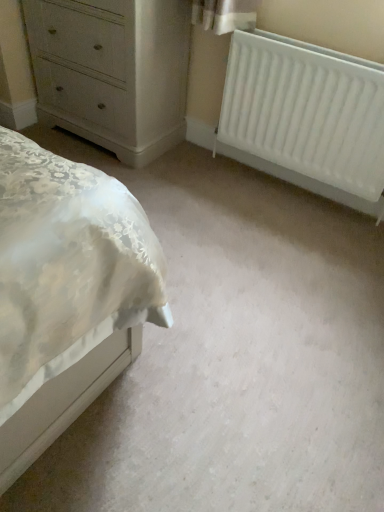
Question: Is white matte radiator at right at the back of white painted wood chest of drawers at upper left?

Choices:
 (A) no
 (B) yes

Answer: (A)

Question: Is the surface of white painted wood chest of drawers at upper left in direct contact with white matte radiator at right?

Choices:
 (A) yes
 (B) no

Answer: (B)

Question: Does white painted wood chest of drawers at upper left have a greater width compared to white matte radiator at right?

Choices:
 (A) yes
 (B) no

Answer: (A)

Question: Is the position of white painted wood chest of drawers at upper left more distant than that of white matte radiator at right?

Choices:
 (A) no
 (B) yes

Answer: (B)

Question: From the image's perspective, is white painted wood chest of drawers at upper left on top of white matte radiator at right?

Choices:
 (A) yes
 (B) no

Answer: (A)

Question: Does white painted wood chest of drawers at upper left have a lesser width compared to white matte radiator at right?

Choices:
 (A) no
 (B) yes

Answer: (A)

Question: Is white matte radiator at right at the right side of white painted wood chest of drawers at upper left?

Choices:
 (A) no
 (B) yes

Answer: (B)

Question: Is white matte radiator at right closer to camera compared to white painted wood chest of drawers at upper left?

Choices:
 (A) yes
 (B) no

Answer: (A)

Question: Is white matte radiator at right touching white painted wood chest of drawers at upper left?

Choices:
 (A) no
 (B) yes

Answer: (A)

Question: Does white matte radiator at right have a greater width compared to white painted wood chest of drawers at upper left?

Choices:
 (A) yes
 (B) no

Answer: (B)

Question: Is white matte radiator at right turned away from white painted wood chest of drawers at upper left?

Choices:
 (A) no
 (B) yes

Answer: (A)

Question: Is white painted wood chest of drawers at upper left located within white matte radiator at right?

Choices:
 (A) no
 (B) yes

Answer: (A)

Question: Is point (135, 154) closer or farther from the camera than point (254, 139)?

Choices:
 (A) farther
 (B) closer

Answer: (A)